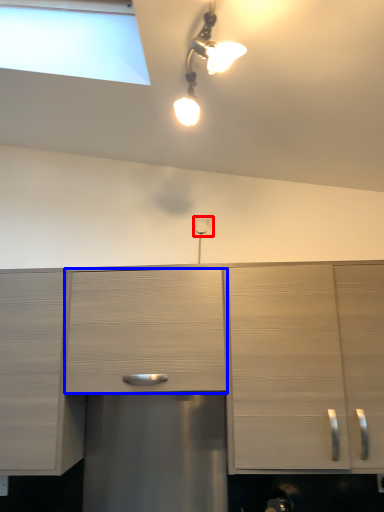
Question: Which object is further to the camera taking this photo, electric outlet (highlighted by a red box) or drawer (highlighted by a blue box)?

Choices:
 (A) electric outlet
 (B) drawer

Answer: (A)